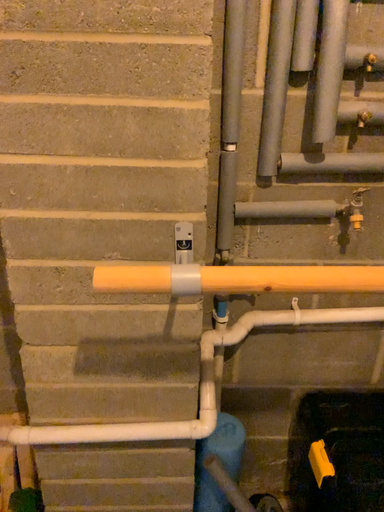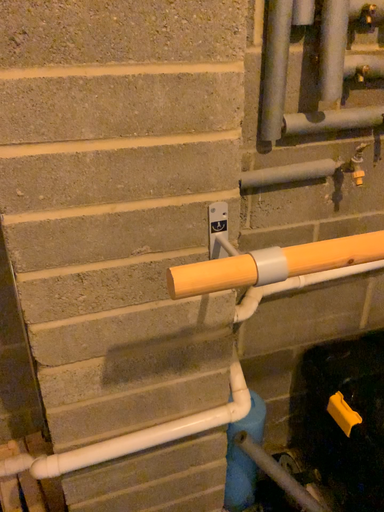
Question: Which way did the camera rotate in the video?

Choices:
 (A) rotated left
 (B) rotated right

Answer: (B)